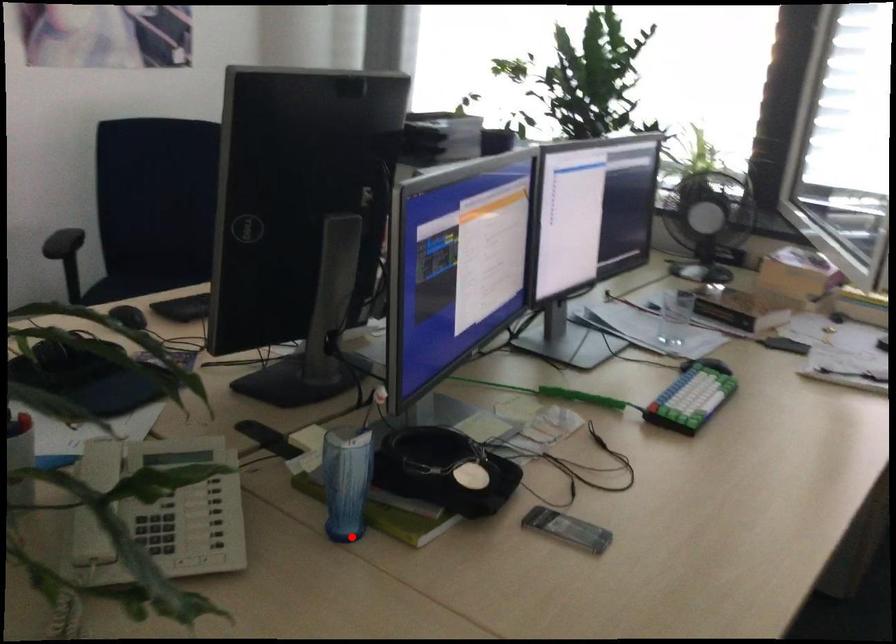
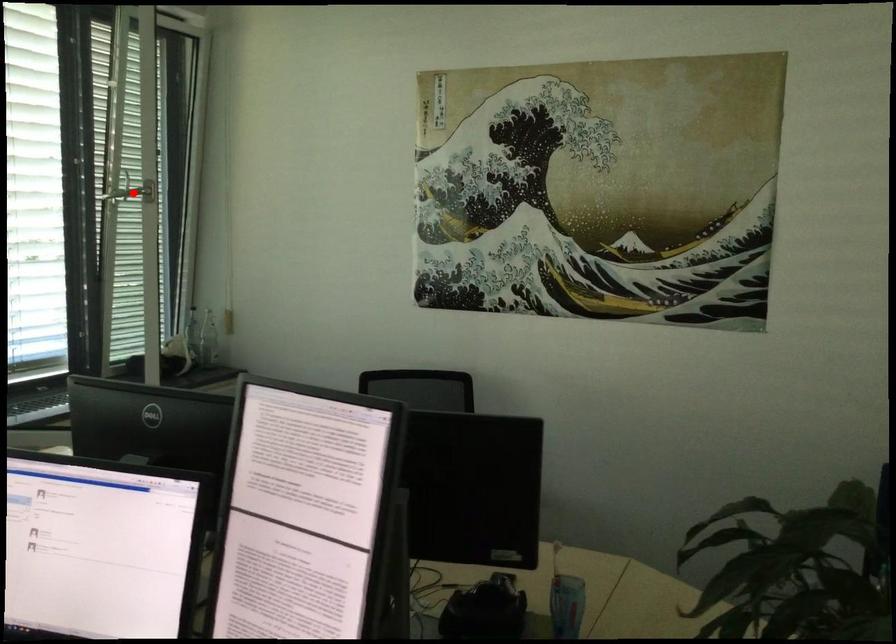
I am providing you with two images of the same scene from different viewpoints. A red point is marked on the first image and another point is marked on the second image. Is the red point in image1 aligned with the point shown in image2?

No